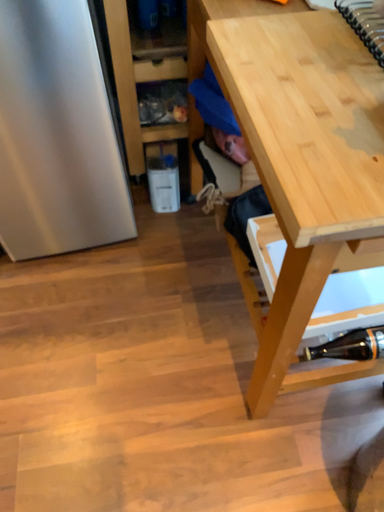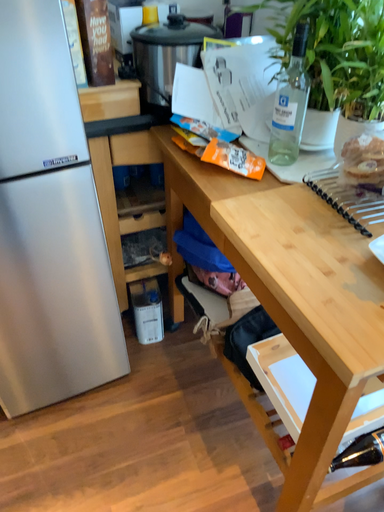
Question: Which way did the camera rotate in the video?

Choices:
 (A) rotated left
 (B) rotated right

Answer: (B)